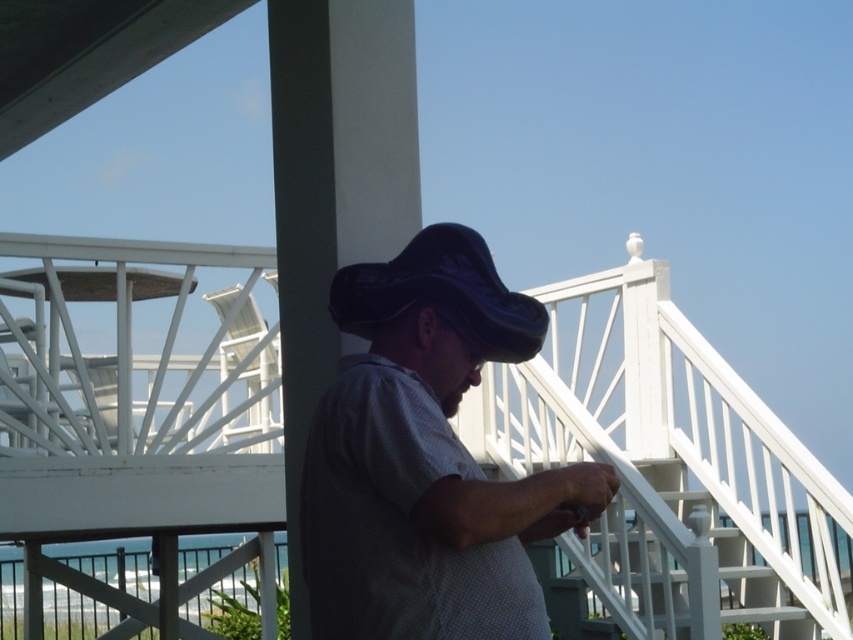
Question: Among these points, which one is nearest to the camera?

Choices:
 (A) (447, 276)
 (B) (453, 465)
 (C) (590, 563)

Answer: (B)

Question: Does matte black hat at center appear under black leather hat at center?

Choices:
 (A) no
 (B) yes

Answer: (B)

Question: Which point appears farthest from the camera in this image?

Choices:
 (A) (425, 264)
 (B) (6, 460)

Answer: (B)

Question: Observing the image, what is the correct spatial positioning of matte black hat at center in reference to black leather hat at center?

Choices:
 (A) below
 (B) above

Answer: (A)

Question: Does matte black hat at center appear over black leather hat at center?

Choices:
 (A) yes
 (B) no

Answer: (B)

Question: Which point appears closest to the camera in this image?

Choices:
 (A) (358, 301)
 (B) (189, 632)
 (C) (318, 477)

Answer: (C)